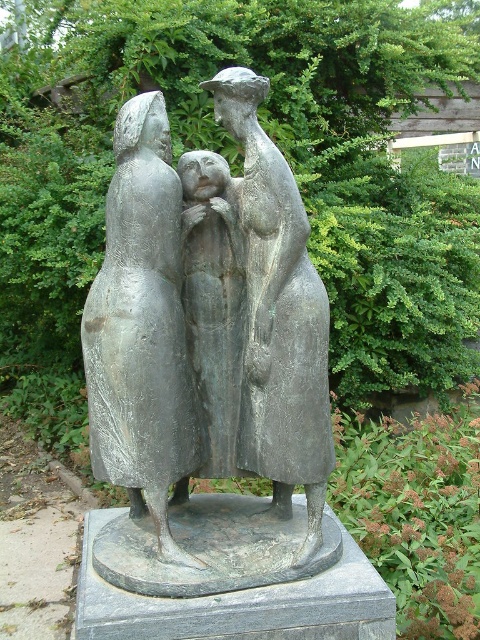
Question: Is bronze sculpture at center to the right of bronze statue at center from the viewer's perspective?

Choices:
 (A) yes
 (B) no

Answer: (B)

Question: Can you confirm if bronze sculpture at center is positioned above bronze statue at center?

Choices:
 (A) no
 (B) yes

Answer: (B)

Question: Does matte gray statue at center have a lesser width compared to bronze sculpture at center?

Choices:
 (A) no
 (B) yes

Answer: (B)

Question: Which object is positioned closest to the matte gray statue at center?

Choices:
 (A) bronze statue at center
 (B) bronze sculpture at center

Answer: (B)

Question: Which object is the closest to the matte gray statue at center?

Choices:
 (A) bronze sculpture at center
 (B) bronze statue at center

Answer: (A)

Question: Which of the following is the closest to the observer?

Choices:
 (A) bronze sculpture at center
 (B) matte gray statue at center

Answer: (B)